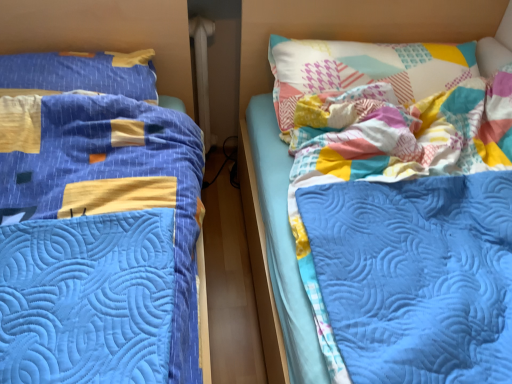
In order to face blue quilted pillow at left, placed as the first pillow when sorted from left to right, should I rotate leftwards or rightwards?

You should look left and rotate roughly 23.670 degrees.

Identify the location of patchwork fabric pillow at upper right, acting as the second pillow starting from the left. The width and height of the screenshot is (512, 384). (362, 69).

Describe the element at coordinates (362, 69) in the screenshot. I see `patchwork fabric pillow at upper right, which is the 1th pillow in right-to-left order` at that location.

I want to click on blue quilted bed at left, so click(96, 224).

I want to click on blue quilted pillow at left, placed as the first pillow when sorted from left to right, so (x=80, y=74).

Are blue quilted bed at left and blue quilted pillow at left, placed as the first pillow when sorted from left to right, far apart?

That's not correct — blue quilted bed at left is a little close to blue quilted pillow at left, placed as the first pillow when sorted from left to right.

Which of these two, blue quilted bed at left or blue quilted pillow at left, the 2th pillow when ordered from right to left, is thinner?

Thinner between the two is blue quilted pillow at left, the 2th pillow when ordered from right to left.

Is the position of blue quilted bed at left more distant than that of blue quilted pillow at left, placed as the first pillow when sorted from left to right?

No, the depth of blue quilted bed at left is less than that of blue quilted pillow at left, placed as the first pillow when sorted from left to right.

Is blue quilted bed at left at the left side of patchwork fabric pillow at upper right, which is the 1th pillow in right-to-left order?

Correct, you'll find blue quilted bed at left to the left of patchwork fabric pillow at upper right, which is the 1th pillow in right-to-left order.

Which object is thinner, blue quilted bed at left or patchwork fabric pillow at upper right, which is the 1th pillow in right-to-left order?

With smaller width is patchwork fabric pillow at upper right, which is the 1th pillow in right-to-left order.

Considering the relative sizes of blue quilted bed at left and patchwork fabric pillow at upper right, which is the 1th pillow in right-to-left order, in the image provided, is blue quilted bed at left bigger than patchwork fabric pillow at upper right, which is the 1th pillow in right-to-left order,?

Correct, blue quilted bed at left is larger in size than patchwork fabric pillow at upper right, which is the 1th pillow in right-to-left order.

Is the depth of blue quilted bed at left less than that of patchwork fabric pillow at upper right, which is the 1th pillow in right-to-left order?

Yes, blue quilted bed at left is in front of patchwork fabric pillow at upper right, which is the 1th pillow in right-to-left order.

How different are the orientations of blue quilted pillow at left, the 2th pillow when ordered from right to left, and blue quilted bed at left in degrees?

They differ by 7.49e-05 degrees in their facing directions.

From a real-world perspective, is blue quilted pillow at left, the 2th pillow when ordered from right to left, located higher than blue quilted bed at left?

Correct, in the physical world, blue quilted pillow at left, the 2th pillow when ordered from right to left, is higher than blue quilted bed at left.

Are blue quilted pillow at left, the 2th pillow when ordered from right to left, and blue quilted bed at left making contact?

There is a gap between blue quilted pillow at left, the 2th pillow when ordered from right to left, and blue quilted bed at left.

Is the depth of blue quilted pillow at left, placed as the first pillow when sorted from left to right, greater than that of blue quilted bed at left?

Yes, it is.

Is patchwork fabric pillow at upper right, which is the 1th pillow in right-to-left order, far from blue quilted bed at left?

Actually, patchwork fabric pillow at upper right, which is the 1th pillow in right-to-left order, and blue quilted bed at left are a little close together.

Can you confirm if patchwork fabric pillow at upper right, which is the 1th pillow in right-to-left order, is positioned to the left of blue quilted bed at left?

No, patchwork fabric pillow at upper right, which is the 1th pillow in right-to-left order, is not to the left of blue quilted bed at left.

From a real-world perspective, is patchwork fabric pillow at upper right, acting as the second pillow starting from the left, physically located above or below blue quilted bed at left?

patchwork fabric pillow at upper right, acting as the second pillow starting from the left, is above blue quilted bed at left.

Looking at this image, from the image's perspective, would you say blue quilted pillow at left, placed as the first pillow when sorted from left to right, is positioned over patchwork fabric pillow at upper right, which is the 1th pillow in right-to-left order?

Yes, from the image's perspective, blue quilted pillow at left, placed as the first pillow when sorted from left to right, is on top of patchwork fabric pillow at upper right, which is the 1th pillow in right-to-left order.

Is blue quilted pillow at left, placed as the first pillow when sorted from left to right, looking in the opposite direction of patchwork fabric pillow at upper right, acting as the second pillow starting from the left?

No, blue quilted pillow at left, placed as the first pillow when sorted from left to right,'s orientation is not away from patchwork fabric pillow at upper right, acting as the second pillow starting from the left.

Consider the image. Can patchwork fabric pillow at upper right, acting as the second pillow starting from the left, be found inside blue quilted pillow at left, the 2th pillow when ordered from right to left?

No, patchwork fabric pillow at upper right, acting as the second pillow starting from the left, is not inside blue quilted pillow at left, the 2th pillow when ordered from right to left.

In the scene shown: Between patchwork fabric pillow at upper right, which is the 1th pillow in right-to-left order, and blue quilted pillow at left, the 2th pillow when ordered from right to left, which one has smaller width?

blue quilted pillow at left, the 2th pillow when ordered from right to left.

Considering their positions, is patchwork fabric pillow at upper right, acting as the second pillow starting from the left, located in front of or behind blue quilted pillow at left, placed as the first pillow when sorted from left to right?

Clearly, patchwork fabric pillow at upper right, acting as the second pillow starting from the left, is in front of blue quilted pillow at left, placed as the first pillow when sorted from left to right.

From the image's perspective, is patchwork fabric pillow at upper right, which is the 1th pillow in right-to-left order, under blue quilted pillow at left, placed as the first pillow when sorted from left to right?

Yes, from the image's perspective, patchwork fabric pillow at upper right, which is the 1th pillow in right-to-left order, is below blue quilted pillow at left, placed as the first pillow when sorted from left to right.

Is blue quilted pillow at left, placed as the first pillow when sorted from left to right, at the back of patchwork fabric pillow at upper right, which is the 1th pillow in right-to-left order?

That's not correct — patchwork fabric pillow at upper right, which is the 1th pillow in right-to-left order, is not looking away from blue quilted pillow at left, placed as the first pillow when sorted from left to right.

This screenshot has height=384, width=512. Find the location of `bed that appears below the blue quilted pillow at left, the 2th pillow when ordered from right to left (from the image's perspective)`. bed that appears below the blue quilted pillow at left, the 2th pillow when ordered from right to left (from the image's perspective) is located at coordinates (96, 224).

The image size is (512, 384). I want to click on bed that appears on the left of patchwork fabric pillow at upper right, which is the 1th pillow in right-to-left order, so click(96, 224).

Looking at the image, which one is located closer to blue quilted pillow at left, placed as the first pillow when sorted from left to right, patchwork fabric pillow at upper right, acting as the second pillow starting from the left, or blue quilted bed at left?

blue quilted bed at left.

Looking at the image, which one is located further to patchwork fabric pillow at upper right, which is the 1th pillow in right-to-left order, blue quilted bed at left or blue quilted pillow at left, the 2th pillow when ordered from right to left?

blue quilted pillow at left, the 2th pillow when ordered from right to left, lies further to patchwork fabric pillow at upper right, which is the 1th pillow in right-to-left order, than the other object.

Looking at this image, estimate the real-world distances between objects in this image. Which object is closer to blue quilted bed at left, patchwork fabric pillow at upper right, acting as the second pillow starting from the left, or blue quilted pillow at left, placed as the first pillow when sorted from left to right?

The object closer to blue quilted bed at left is blue quilted pillow at left, placed as the first pillow when sorted from left to right.

Which object lies further to the anchor point blue quilted bed at left, blue quilted pillow at left, placed as the first pillow when sorted from left to right, or patchwork fabric pillow at upper right, acting as the second pillow starting from the left?

patchwork fabric pillow at upper right, acting as the second pillow starting from the left.

Which object lies nearer to the anchor point patchwork fabric pillow at upper right, which is the 1th pillow in right-to-left order, blue quilted pillow at left, placed as the first pillow when sorted from left to right, or blue quilted bed at left?

blue quilted bed at left.

Which object lies nearer to the anchor point blue quilted pillow at left, the 2th pillow when ordered from right to left, blue quilted bed at left or patchwork fabric pillow at upper right, acting as the second pillow starting from the left?

Based on the image, blue quilted bed at left appears to be nearer to blue quilted pillow at left, the 2th pillow when ordered from right to left.

In order to click on pillow between blue quilted bed at left and patchwork fabric pillow at upper right, acting as the second pillow starting from the left in this screenshot , I will do `click(80, 74)`.